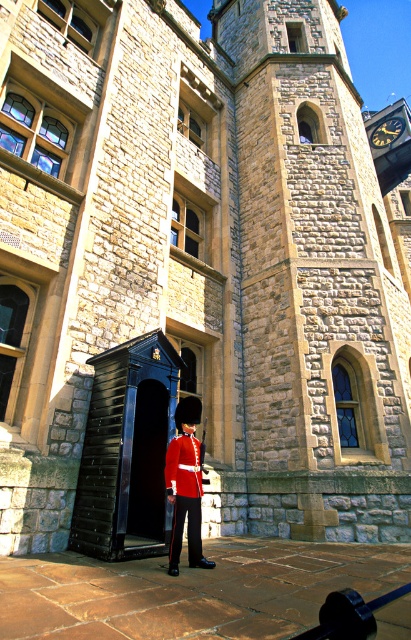
You are a painter who wants to sketch the scene. You have a canvas that can only fit objects up to 30 cm wide. You see the shiny red uniform at center and the metallic clock at upper right. Which object might not fit on your canvas based on their widths?

The metallic clock at upper right might not fit on the canvas because it is wider than the shiny red uniform at center, and the canvas can only accommodate objects up to 30 cm wide.

You are a tourist visiting the historic stone building and want to enter through the main entrance. Based on the coordinates provided, where exactly should you head to locate the black glossy door at center?

The black glossy door at center is located at the coordinates point (x=147, y=464), so you should head to that exact point to locate the door.

You are a visitor approaching the historic stone building. You see the black glossy door at center and the metallic clock at upper right. Which object is positioned higher up in the scene?

The metallic clock at upper right is positioned higher up in the scene than the black glossy door at center.